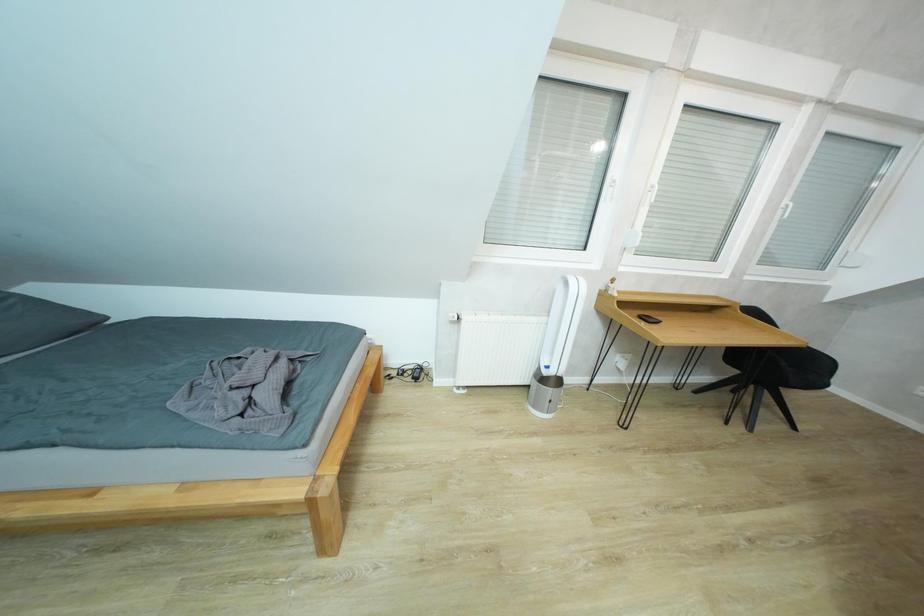
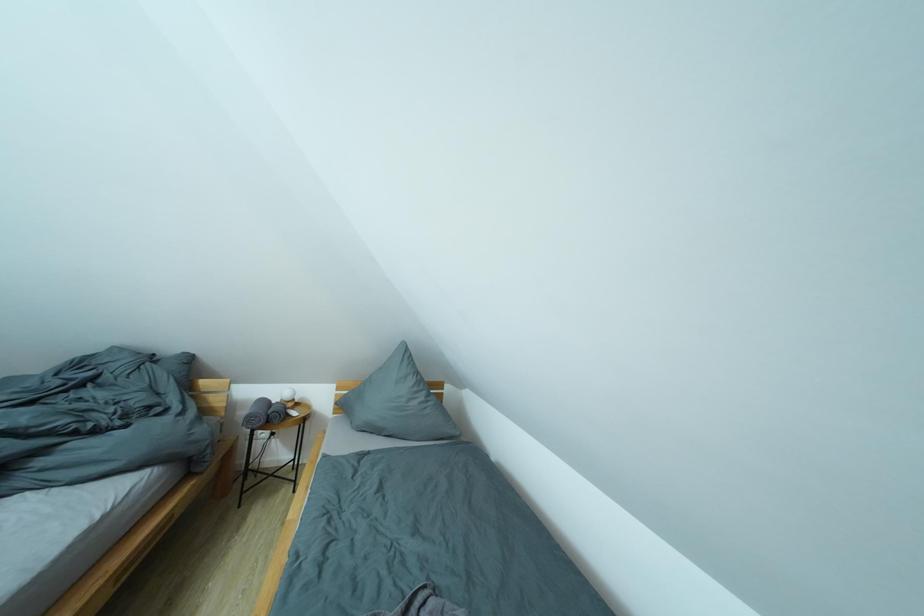
Question: The images are taken continuously from a first-person perspective. In which direction is your viewpoint rotating?

Choices:
 (A) Left
 (B) Right
 (C) Up
 (D) Down

Answer: (A)